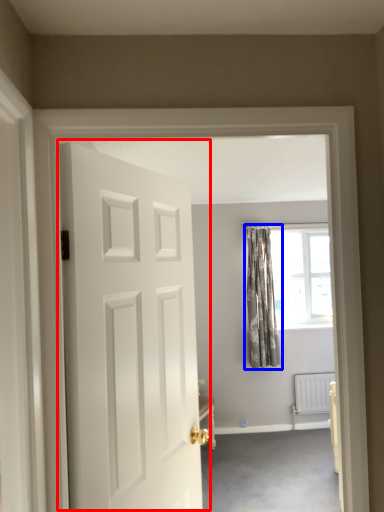
Question: Which point is further to the camera, door (highlighted by a red box) or curtain (highlighted by a blue box)?

Choices:
 (A) door
 (B) curtain

Answer: (B)